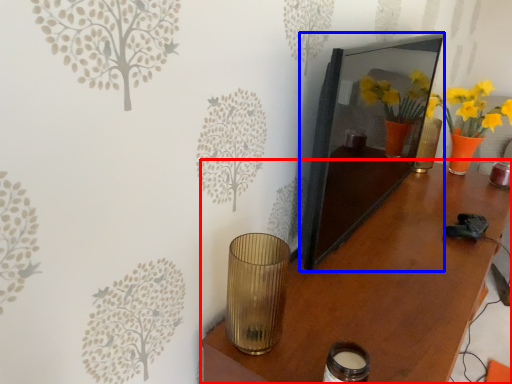
Question: Which object appears closest to the camera in this image, table (highlighted by a red box) or picture frame (highlighted by a blue box)?

Choices:
 (A) table
 (B) picture frame

Answer: (A)